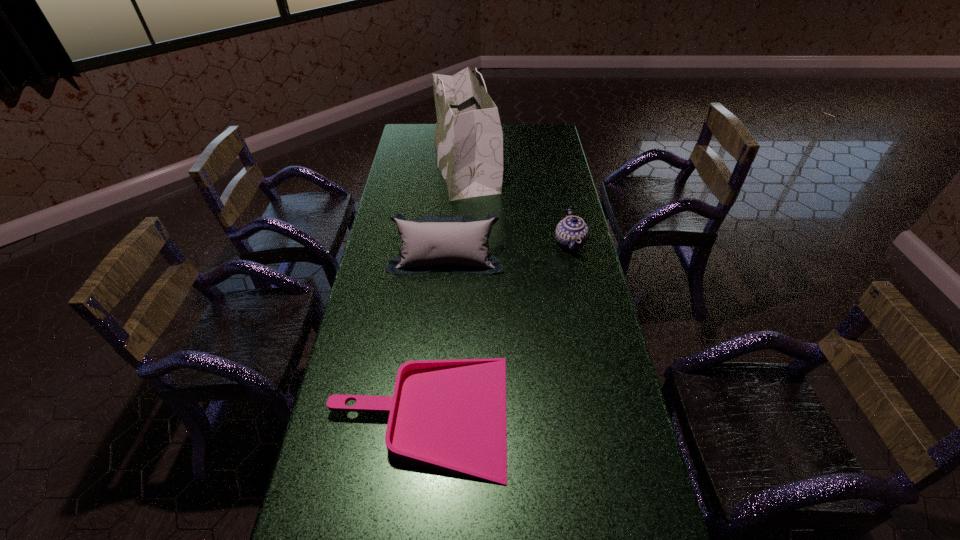
Identify which object is the second closest to the tallest object. Please provide its 2D coordinates. Your answer should be formatted as a tuple, i.e. [(x, y)], where the tuple contains the x and y coordinates of a point satisfying the conditions above.

[(455, 243)]

Find the location of a particular element. vacant space that satisfies the following two spatial constraints: 1. on the surface of the third shortest object; 2. on the handle side of the dustpan is located at coordinates (434, 415).

The image size is (960, 540). I want to click on free space that satisfies the following two spatial constraints: 1. on the surface of the cushion; 2. on the handle side of the shortest object, so click(x=434, y=415).

Image resolution: width=960 pixels, height=540 pixels. I want to click on free space that satisfies the following two spatial constraints: 1. on the surface of the cushion; 2. on the handle side of the dustpan, so click(x=434, y=415).